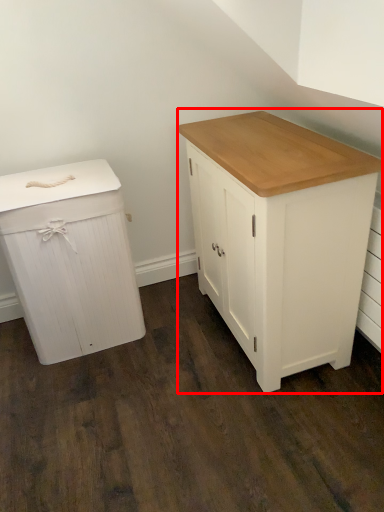
Question: From the image, what is the correct spatial relationship of chest of drawers (annotated by the red box) in relation to chest of drawers?

Choices:
 (A) right
 (B) left

Answer: (A)